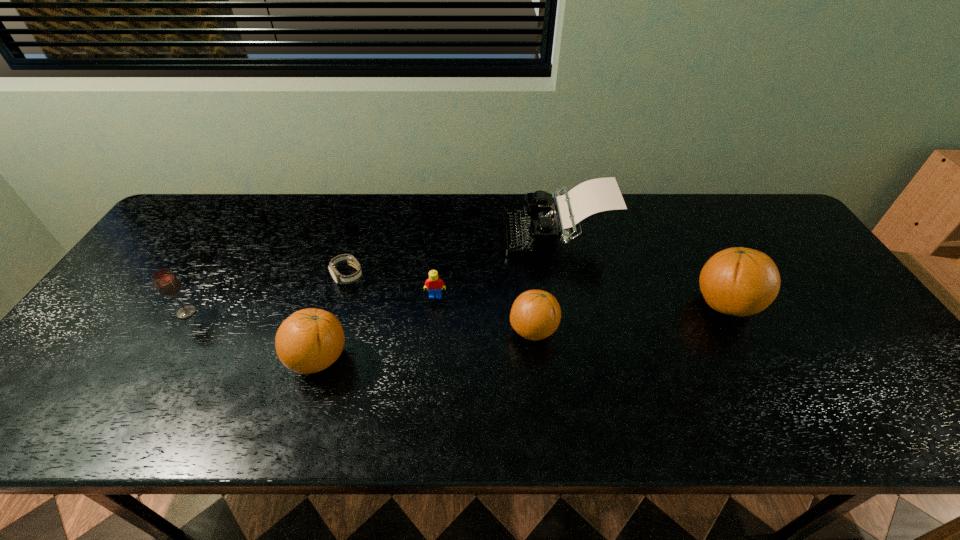
Find the location of a particular element. The image size is (960, 540). the second shortest orange is located at coordinates (310, 340).

Find the location of `the shortest orange`. the shortest orange is located at coordinates (535, 314).

Identify the location of the rightmost orange. The image size is (960, 540). (738, 281).

Image resolution: width=960 pixels, height=540 pixels. Find the location of `typewriter`. typewriter is located at coordinates (533, 232).

Where is `the leftmost object`? the leftmost object is located at coordinates (167, 285).

Locate an element on the screen. This screenshot has height=540, width=960. the shortest object is located at coordinates (351, 260).

What are the coordinates of `Lego` in the screenshot? It's located at (433, 284).

Identify the location of the fourth object from right to left. (433, 284).

I want to click on vacant space located 0.250m on the back of the second shortest orange, so [x=348, y=265].

Identify the location of vacant region located 0.150m on the right of the second orange from left to right. The image size is (960, 540). (618, 330).